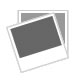
Find the location of a particular element. picture is located at coordinates (49, 54).